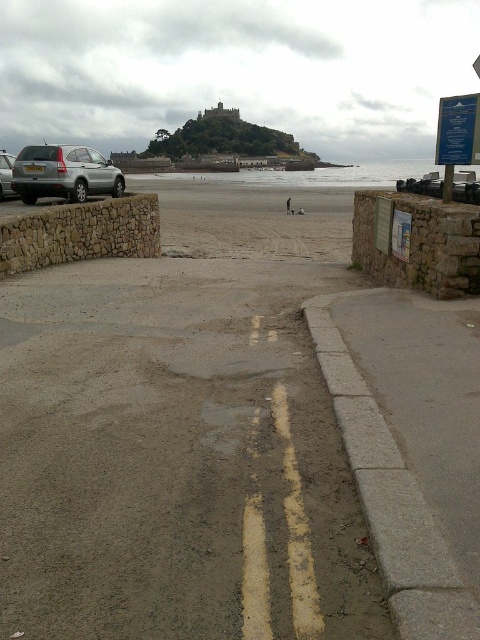
Question: Can you confirm if smooth sand beach at center is thinner than satin silver suv at left?

Choices:
 (A) yes
 (B) no

Answer: (B)

Question: Can you confirm if smooth sand beach at center is smaller than satin silver suv at left?

Choices:
 (A) yes
 (B) no

Answer: (B)

Question: Which object is closer to the camera taking this photo?

Choices:
 (A) silver metallic car at left
 (B) satin silver suv at left
 (C) gray concrete curb at lower right

Answer: (C)

Question: Which of the following is the closest to the observer?

Choices:
 (A) blue plastic sign at upper right
 (B) silver metallic car at left
 (C) smooth sand beach at center

Answer: (C)

Question: Can you confirm if gray concrete curb at lower right is positioned above silver metallic car at left?

Choices:
 (A) no
 (B) yes

Answer: (A)

Question: Which point is farther from the camera taking this photo?

Choices:
 (A) (32, 177)
 (B) (446, 116)

Answer: (A)